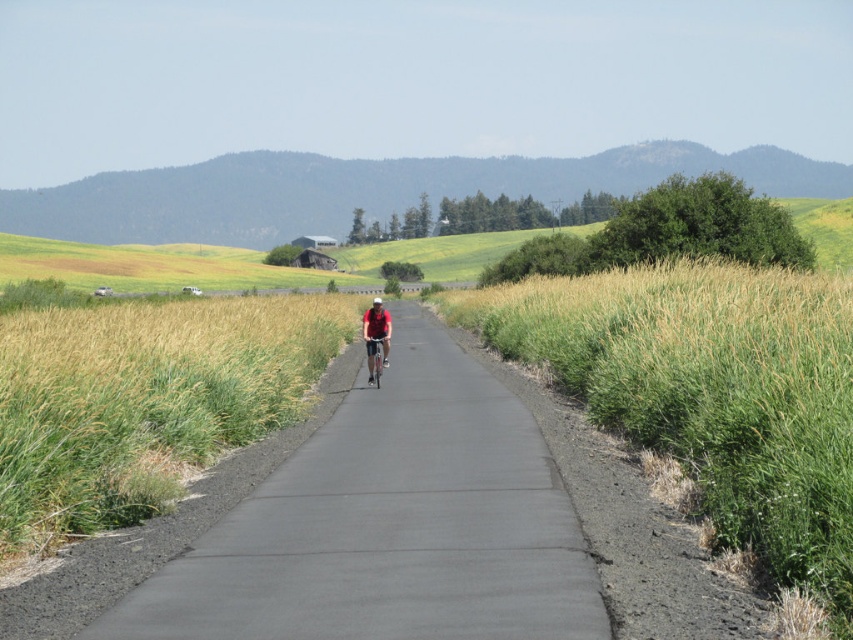
In the scene shown: Is green grass at right closer to the viewer compared to metallic silver bicycle at center?

Yes, it is.

Does green grass at right appear under metallic silver bicycle at center?

No, green grass at right is not below metallic silver bicycle at center.

This screenshot has width=853, height=640. Describe the element at coordinates (709, 392) in the screenshot. I see `green grass at right` at that location.

Identify the location of green grass at right. (709, 392).

What do you see at coordinates (390, 524) in the screenshot? The image size is (853, 640). I see `black asphalt road at center` at bounding box center [390, 524].

In the scene shown: Between black asphalt road at center and metallic silver bicycle at center, which one is positioned higher?

Positioned higher is metallic silver bicycle at center.

Locate an element on the screen. black asphalt road at center is located at coordinates tap(390, 524).

Can you confirm if red matte shirt at center is taller than metallic silver bicycle at center?

Indeed, red matte shirt at center has a greater height compared to metallic silver bicycle at center.

Can you confirm if red matte shirt at center is bigger than metallic silver bicycle at center?

Yes.

Is point (387, 336) positioned before point (376, 348)?

No, it is not.

Find the location of a particular element. red matte shirt at center is located at coordinates (376, 333).